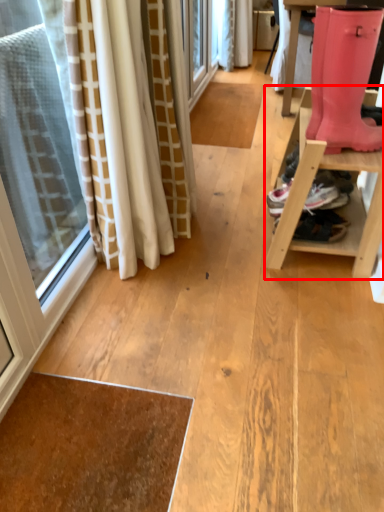
Question: From the image's perspective, what is the correct spatial relationship of furniture (annotated by the red box) in relation to footwear?

Choices:
 (A) above
 (B) below

Answer: (B)